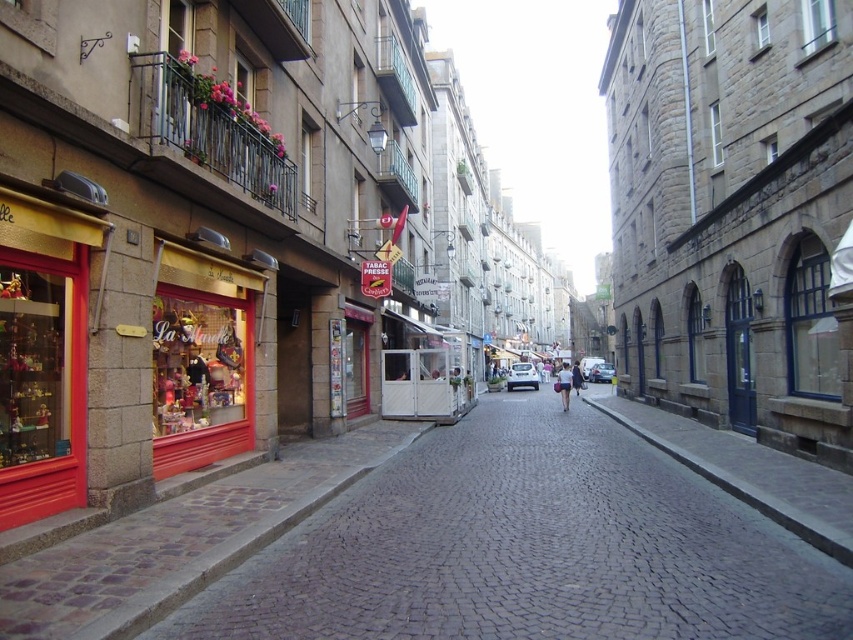
Which is more to the left, cobblestone pavement at center or dark gray stone wall at center?

cobblestone pavement at center

The height and width of the screenshot is (640, 853). What are the coordinates of `cobblestone pavement at center` in the screenshot? It's located at (527, 548).